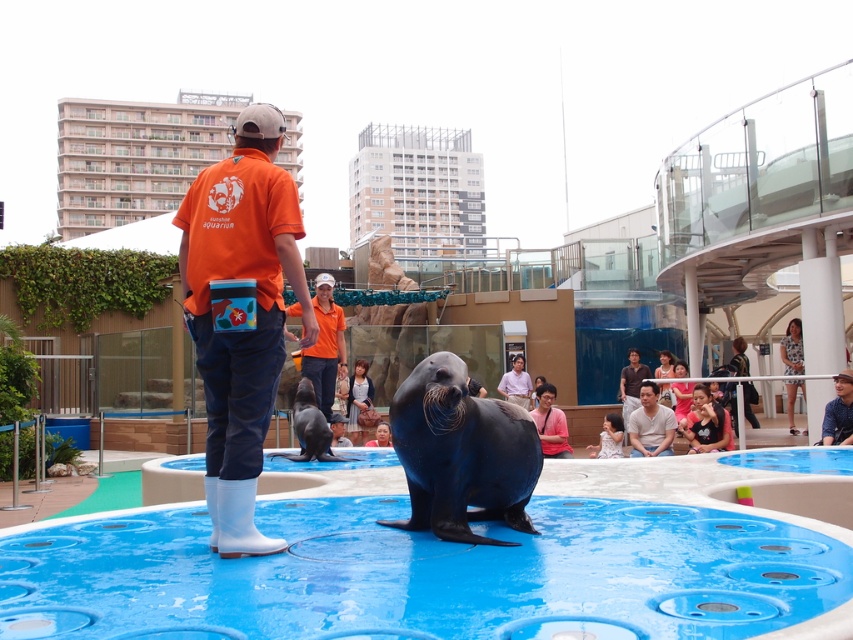
Between point (332, 348) and point (830, 433), which one is positioned behind?

The point (830, 433) is behind.

Measure the distance between point [329,346] and camera.

The distance of point [329,346] from camera is 7.89 meters.

Who is more distant from viewer, (x=323, y=291) or (x=851, y=394)?

The point (x=851, y=394) is behind.

Locate an element on the screen. Image resolution: width=853 pixels, height=640 pixels. orange fabric uniform at center is located at coordinates (323, 344).

Does orange cotton shirt at center come behind matte black jacket at lower right?

No, it is not.

In the scene shown: Can you confirm if orange cotton shirt at center is positioned to the left of matte black jacket at lower right?

Correct, you'll find orange cotton shirt at center to the left of matte black jacket at lower right.

Which is in front, point (252, 396) or point (718, 420)?

Positioned in front is point (252, 396).

Find the location of a particular element. The height and width of the screenshot is (640, 853). orange cotton shirt at center is located at coordinates (241, 314).

Can you confirm if orange cotton shirt at center is positioned to the right of pink matte shirt at center?

No, orange cotton shirt at center is not to the right of pink matte shirt at center.

From the picture: Who is shorter, orange cotton shirt at center or pink matte shirt at center?

pink matte shirt at center is shorter.

Is point (260, 326) positioned before point (540, 392)?

Yes, point (260, 326) is in front of point (540, 392).

Locate an element on the screen. orange cotton shirt at center is located at coordinates (241, 314).